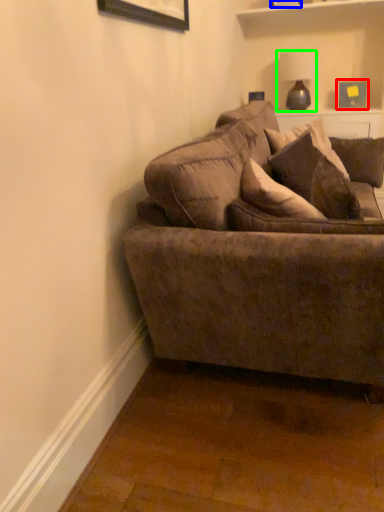
Question: Considering the real-world distances, which object is closest to picture frame (highlighted by a red box)? picture frame (highlighted by a blue box) or lamp (highlighted by a green box).

Choices:
 (A) picture frame
 (B) lamp

Answer: (B)